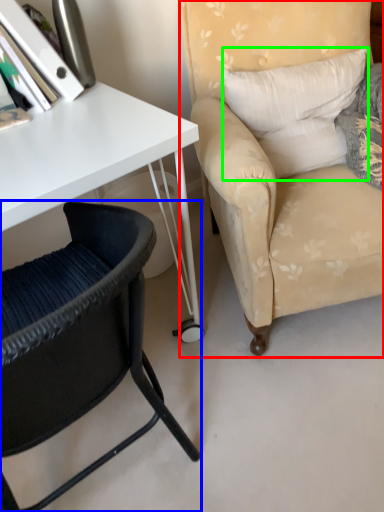
Question: Based on their relative distances, which object is nearer to chair (highlighted by a red box)? Choose from chair (highlighted by a blue box) and pillow (highlighted by a green box).

Choices:
 (A) chair
 (B) pillow

Answer: (B)